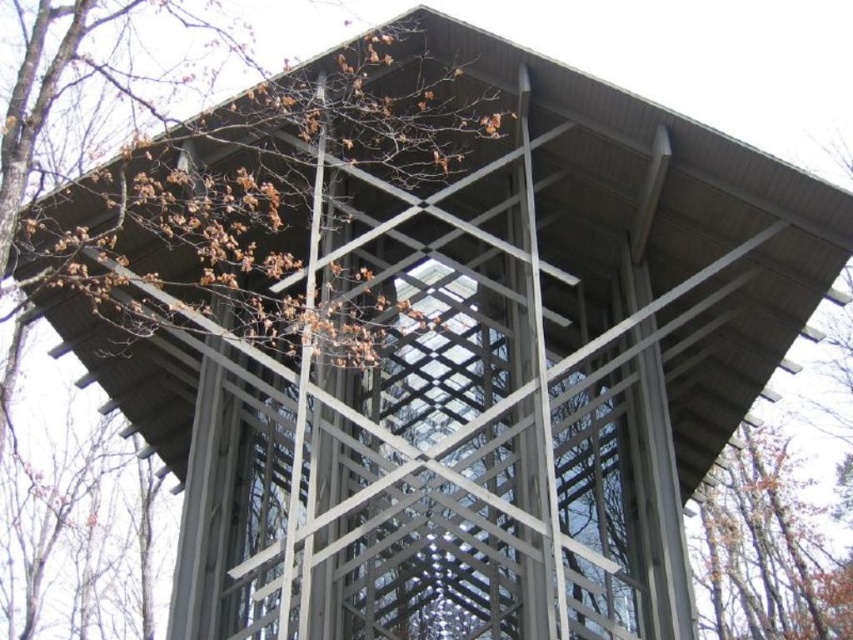
You are standing in the middle of the modern architectural structure and see the point marked at coordinates (264, 198). What object is located at that point?

The point at coordinates (264, 198) marks the location of the brown wood tree at center.